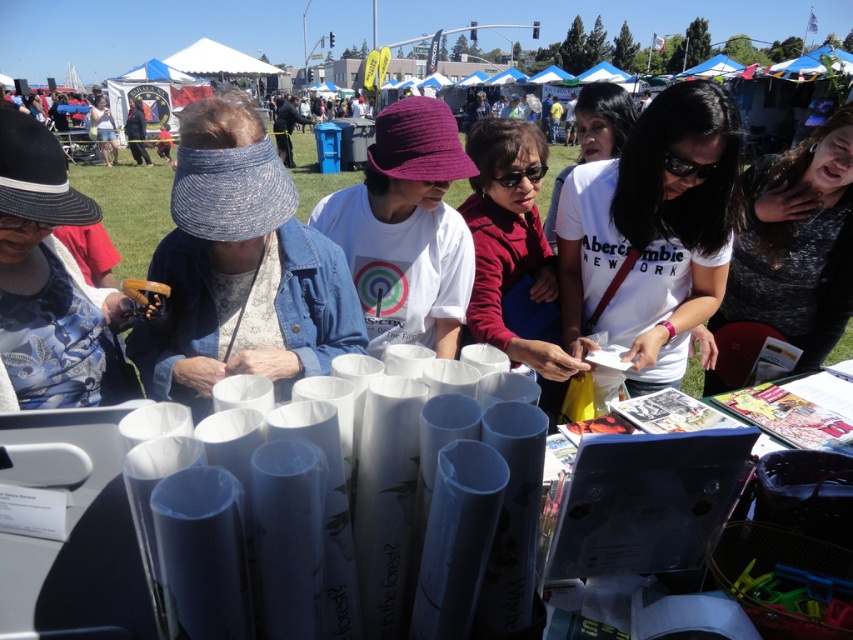
Question: Which of these objects is positioned closest to the denim visor at left?

Choices:
 (A) white paper rolls at center
 (B) matte white shirt at center

Answer: (B)

Question: Does matte white shirt at center appear on the left side of white paper at center?

Choices:
 (A) yes
 (B) no

Answer: (A)

Question: Does white matte shirt at center have a larger size compared to white paper rolls at center?

Choices:
 (A) no
 (B) yes

Answer: (B)

Question: Which of the following is the farthest from the observer?

Choices:
 (A) denim visor at left
 (B) white paper rolls at center
 (C) matte red shirt at center

Answer: (C)

Question: Which object appears closest to the camera in this image?

Choices:
 (A) denim visor at left
 (B) matte white shirt at center
 (C) white cotton shirt at center
 (D) blue denim visor at left

Answer: (D)

Question: Can you confirm if matte white shirt at center is wider than blue denim visor at left?

Choices:
 (A) yes
 (B) no

Answer: (A)